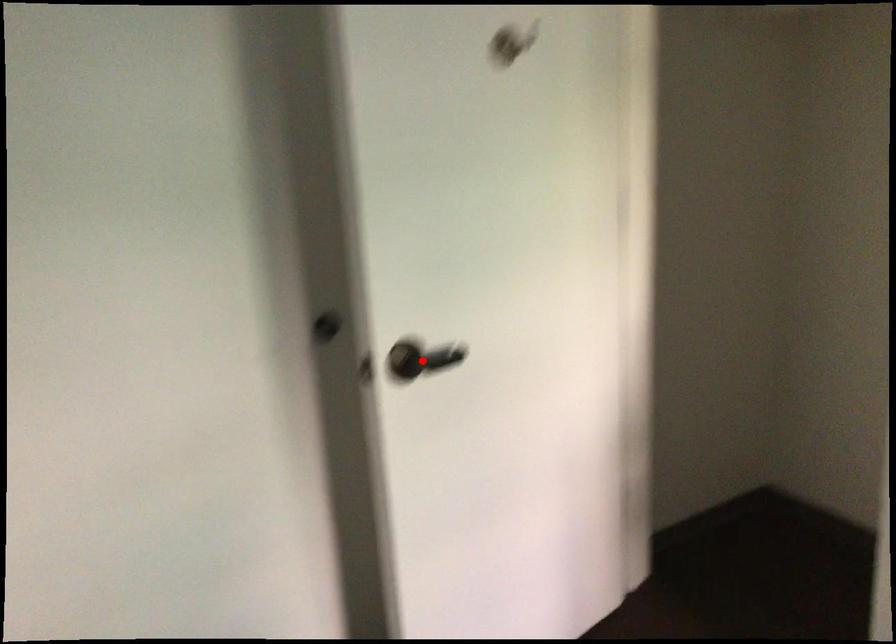
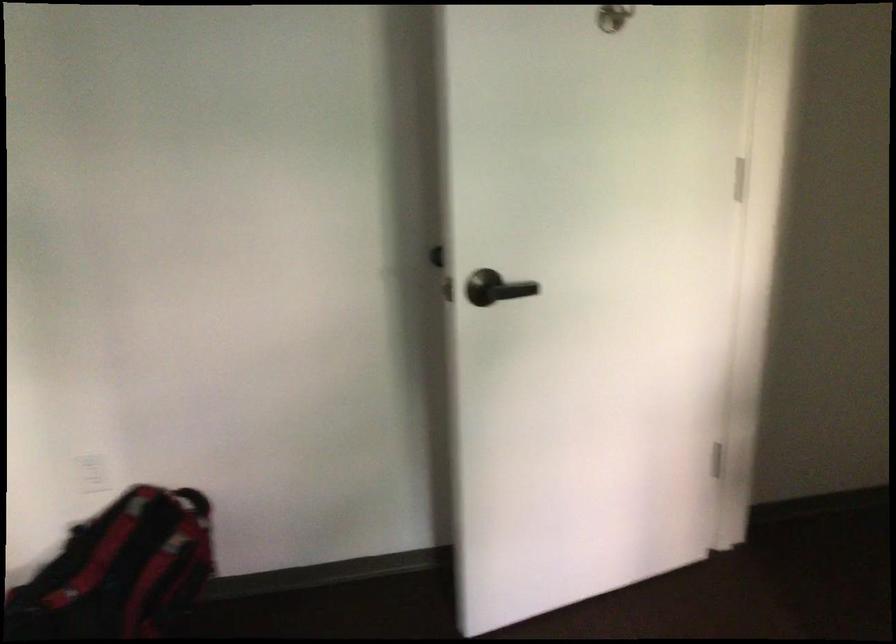
In the second image, find the point that corresponds to the highlighted location in the first image.

(495, 288)